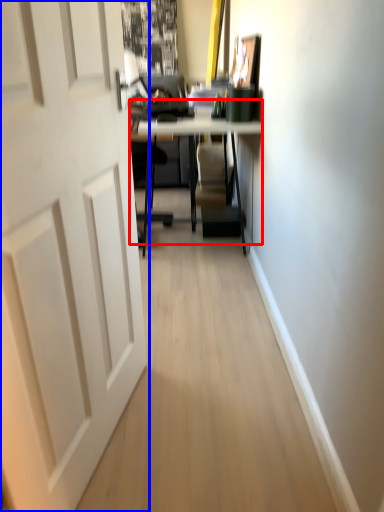
Question: Which of the following is the closest to the observer, table (highlighted by a red box) or door (highlighted by a blue box)?

Choices:
 (A) table
 (B) door

Answer: (B)